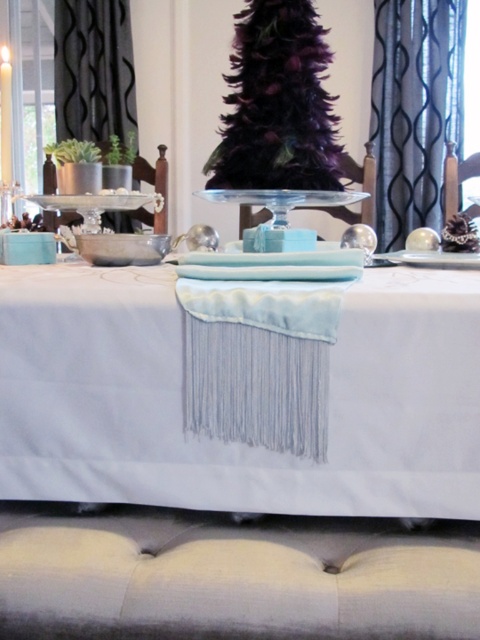
Is light blue fabric at center shorter than dark purple feathered christmas tree at center?

Yes.

Who is lower down, light blue fabric at center or dark purple feathered christmas tree at center?

light blue fabric at center is below.

What do you see at coordinates (237, 442) in the screenshot? I see `light blue fabric at center` at bounding box center [237, 442].

The width and height of the screenshot is (480, 640). I want to click on light blue fabric at center, so click(237, 442).

Consider the image. Is satin blue curtain at upper right taller than black textured curtain at left?

Indeed, satin blue curtain at upper right has a greater height compared to black textured curtain at left.

Is satin blue curtain at upper right positioned behind black textured curtain at left?

No, satin blue curtain at upper right is closer to the viewer.

This screenshot has height=640, width=480. Describe the element at coordinates (415, 109) in the screenshot. I see `satin blue curtain at upper right` at that location.

At what (x,y) coordinates should I click in order to perform the action: click on satin blue curtain at upper right. Please return your answer as a coordinate pair (x, y). This screenshot has height=640, width=480. Looking at the image, I should click on tap(415, 109).

Is light blue fabric at center thinner than black textured curtain at left?

No.

Which is behind, point (143, 456) or point (107, 115)?

The point (107, 115) is behind.

Is point (424, 456) positioned behind point (118, 83)?

No, it is in front of (118, 83).

In order to click on light blue fabric at center in this screenshot , I will do `click(237, 442)`.